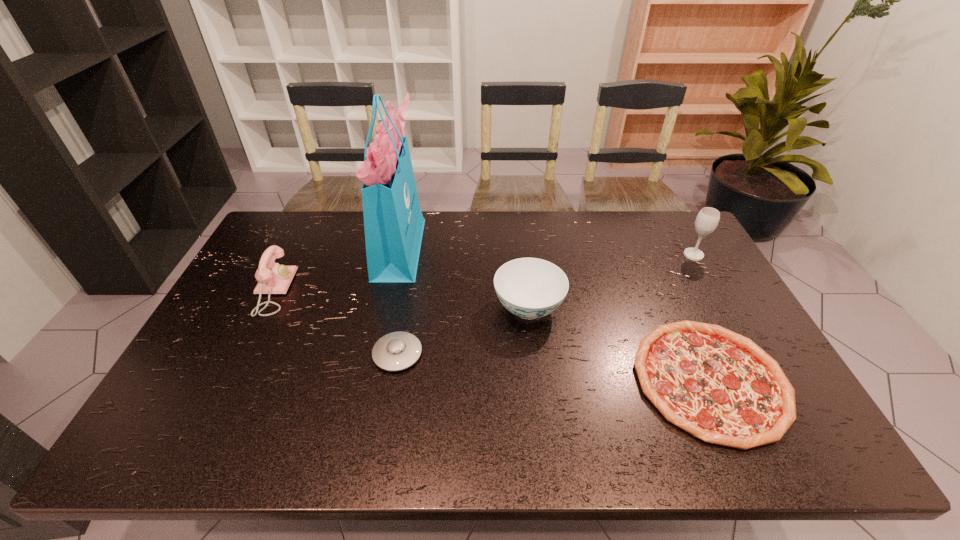
Where is `vacant region located 0.350m on the left of the second shortest object`? vacant region located 0.350m on the left of the second shortest object is located at coordinates (242, 354).

Where is `free space located on the left of the shortest object`? The width and height of the screenshot is (960, 540). free space located on the left of the shortest object is located at coordinates (487, 380).

This screenshot has height=540, width=960. I want to click on shopping bag that is positioned at the far edge, so click(x=393, y=221).

The image size is (960, 540). What are the coordinates of `wineglass situated at the far edge` in the screenshot? It's located at (708, 218).

This screenshot has height=540, width=960. I want to click on object located at the near edge, so click(721, 387).

What are the coordinates of `object that is positioned at the left edge` in the screenshot? It's located at (272, 278).

Locate an element on the screen. The height and width of the screenshot is (540, 960). wineglass at the right edge is located at coordinates (708, 218).

Where is `pizza at the right edge`? Image resolution: width=960 pixels, height=540 pixels. pizza at the right edge is located at coordinates (721, 387).

I want to click on object present at the far right corner, so click(x=708, y=218).

Where is `object that is at the near right corner`? The image size is (960, 540). object that is at the near right corner is located at coordinates (721, 387).